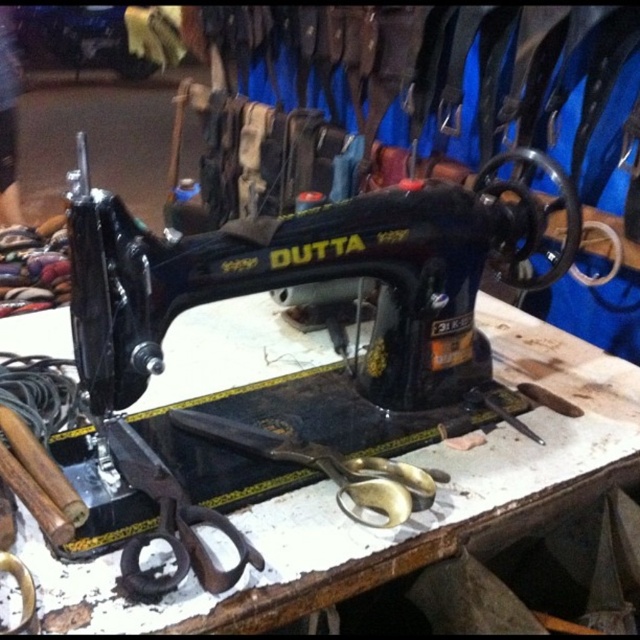
You are an interior designer looking at the image of a vintage sewing setup. You need to place a decorative item exactly at the center of the table. The table is a square with coordinates ranging from 0 to 1 on both axes. The black matte sewing machine at center is already placed at point 0.444, 0.463. Will the sewing machine be off the center of the table?

The black matte sewing machine at center is located at point (296, 284), which is very close to the true center of the table at (320, 320). The slight difference in coordinates means it is slightly off the exact center but very near.

You are organizing a workshop and need to place a new tool between the black matte sewing machine at center and the black metal scissors at lower left. Based on their positions, where should you place the new tool?

The new tool should be placed below the black matte sewing machine at center and above the black metal scissors at lower left since the sewing machine is positioned above the scissors.